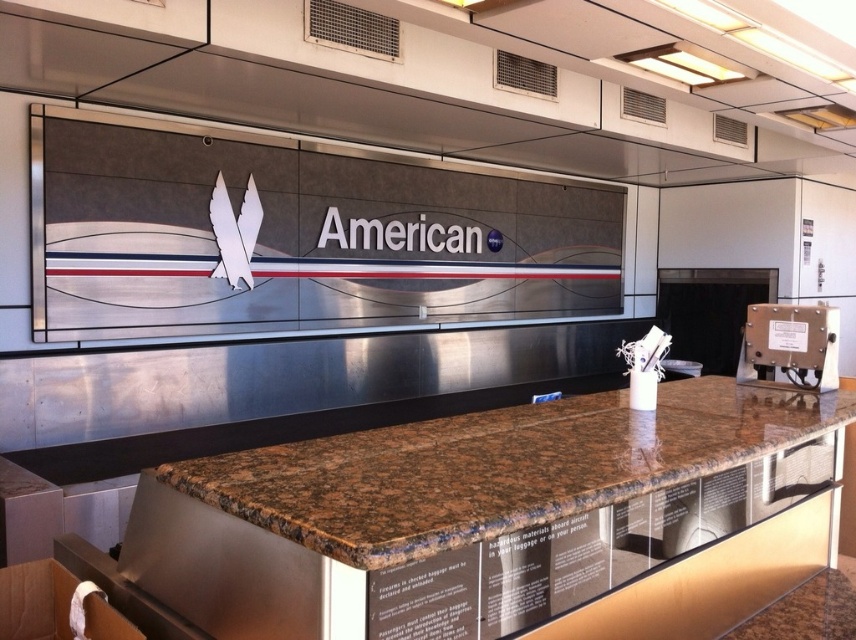
You are standing in the airport terminal and need to locate the metallic gray panel at right. According to the coordinates provided, where would you find it?

The metallic gray panel at right is located at point [789,346].

You are a traveler at an airport terminal and need to locate the metallic gray panel at right and the white matte wings at center. According to the scene, which object is positioned to the right of the other?

The metallic gray panel at right is to the right of white matte wings at center.